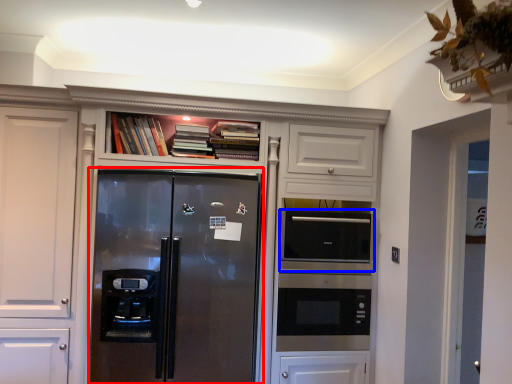
Question: Which of the following is the farthest to the observer, refrigerator (highlighted by a red box) or appliance (highlighted by a blue box)?

Choices:
 (A) refrigerator
 (B) appliance

Answer: (B)